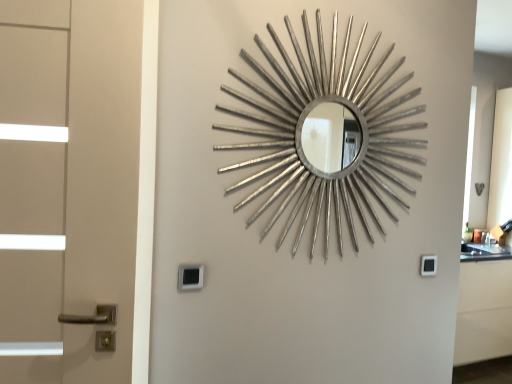
Question: Considering the relative positions of black plastic lock at lower center, which appears as the 1th lock when viewed from the left, and black plastic lock at lower right, which is counted as the first lock, starting from the right, in the image provided, is black plastic lock at lower center, which appears as the 1th lock when viewed from the left, behind black plastic lock at lower right, which is counted as the first lock, starting from the right,?

Choices:
 (A) yes
 (B) no

Answer: (B)

Question: Is black plastic lock at lower center, which appears as the 2th lock when viewed from the back, looking in the opposite direction of black plastic lock at lower right, the 1th lock in the back-to-front sequence?

Choices:
 (A) yes
 (B) no

Answer: (B)

Question: Can you confirm if black plastic lock at lower center, arranged as the first lock when viewed from the front, is bigger than black plastic lock at lower right, which is the second lock from left to right?

Choices:
 (A) no
 (B) yes

Answer: (B)

Question: Can you confirm if black plastic lock at lower center, which appears as the 1th lock when viewed from the left, is taller than black plastic lock at lower right, which is counted as the first lock, starting from the right?

Choices:
 (A) yes
 (B) no

Answer: (A)

Question: Is black plastic lock at lower center, arranged as the first lock when viewed from the front, oriented towards black plastic lock at lower right, which is the second lock from left to right?

Choices:
 (A) yes
 (B) no

Answer: (B)

Question: From the image's perspective, does black plastic lock at lower center, which appears as the 2th lock when viewed from the back, appear lower than black plastic lock at lower right, the 1th lock in the back-to-front sequence?

Choices:
 (A) no
 (B) yes

Answer: (A)

Question: Does silver metallic mirror at center appear on the right side of black plastic lock at lower right, which is the second lock from left to right?

Choices:
 (A) yes
 (B) no

Answer: (B)

Question: Is silver metallic mirror at center thinner than black plastic lock at lower right, the 2th lock viewed from the front?

Choices:
 (A) yes
 (B) no

Answer: (B)

Question: Is the position of silver metallic mirror at center more distant than that of black plastic lock at lower right, which is the second lock from left to right?

Choices:
 (A) yes
 (B) no

Answer: (B)

Question: From the image's perspective, is silver metallic mirror at center above black plastic lock at lower right, the 1th lock in the back-to-front sequence?

Choices:
 (A) yes
 (B) no

Answer: (A)

Question: Is silver metallic mirror at center to the left of black plastic lock at lower right, which is the second lock from left to right, from the viewer's perspective?

Choices:
 (A) yes
 (B) no

Answer: (A)

Question: Is silver metallic mirror at center next to black plastic lock at lower right, the 1th lock in the back-to-front sequence?

Choices:
 (A) no
 (B) yes

Answer: (A)

Question: Can you confirm if silver metallic mirror at center is wider than black plastic lock at lower center, which appears as the 2th lock when viewed from the back?

Choices:
 (A) no
 (B) yes

Answer: (B)